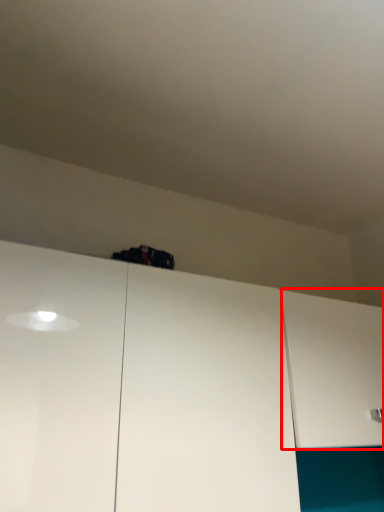
Question: In this image, where is cabinetry (annotated by the red box) located relative to cabinetry?

Choices:
 (A) left
 (B) right

Answer: (B)